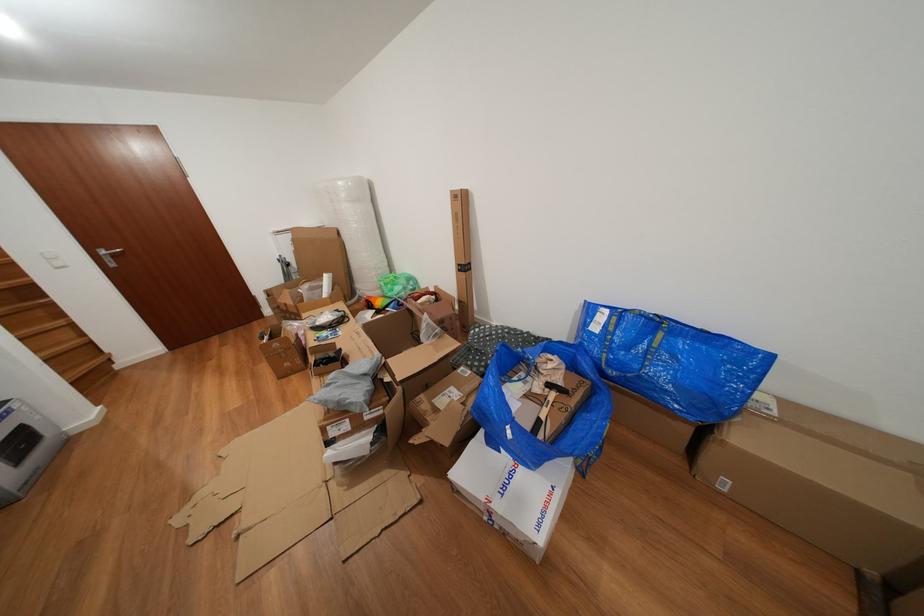
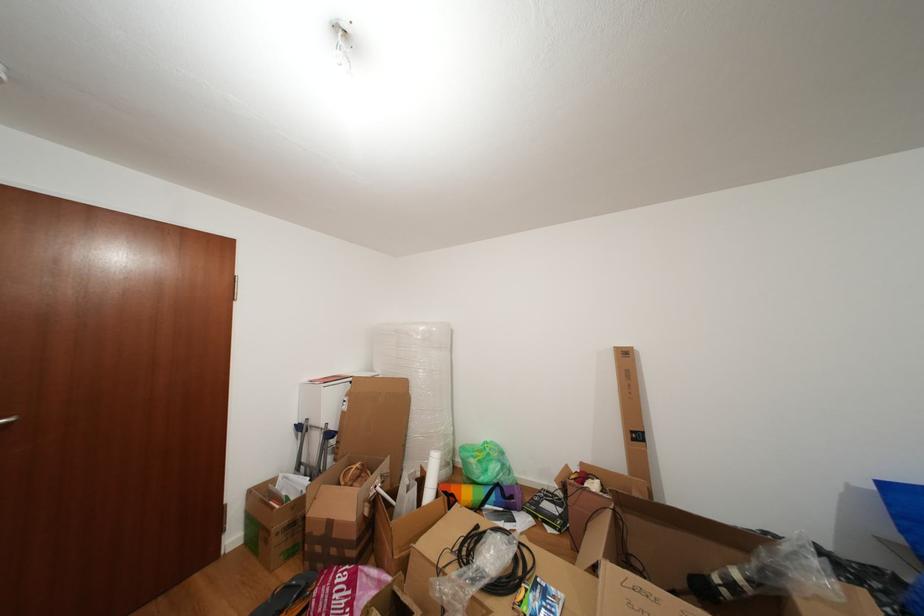
In the second image, find the point that corresponds to the point at 382,280 in the first image.

(450, 448)